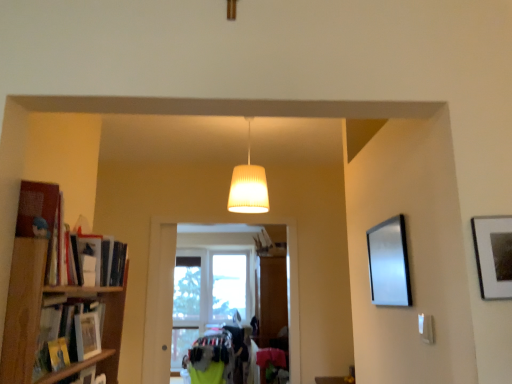
Question: From a real-world perspective, is silver metallic picture frame at right located beneath wooden bookshelf at left?

Choices:
 (A) yes
 (B) no

Answer: (B)

Question: Considering the relative positions of silver metallic picture frame at right and wooden bookshelf at left in the image provided, is silver metallic picture frame at right behind wooden bookshelf at left?

Choices:
 (A) yes
 (B) no

Answer: (A)

Question: Is silver metallic picture frame at right not close to wooden bookshelf at left?

Choices:
 (A) yes
 (B) no

Answer: (A)

Question: From the image's perspective, does silver metallic picture frame at right appear lower than wooden bookshelf at left?

Choices:
 (A) no
 (B) yes

Answer: (A)

Question: From the image's perspective, does silver metallic picture frame at right appear higher than wooden bookshelf at left?

Choices:
 (A) yes
 (B) no

Answer: (A)

Question: Are silver metallic picture frame at right and wooden bookshelf at left making contact?

Choices:
 (A) no
 (B) yes

Answer: (A)

Question: Is the depth of silver metallic picture frame at right greater than that of white ribbed lampshade at center?

Choices:
 (A) no
 (B) yes

Answer: (A)

Question: Is silver metallic picture frame at right shorter than white ribbed lampshade at center?

Choices:
 (A) yes
 (B) no

Answer: (A)

Question: Considering the relative sizes of silver metallic picture frame at right and white ribbed lampshade at center in the image provided, is silver metallic picture frame at right taller than white ribbed lampshade at center?

Choices:
 (A) no
 (B) yes

Answer: (A)

Question: From a real-world perspective, is silver metallic picture frame at right on white ribbed lampshade at center?

Choices:
 (A) no
 (B) yes

Answer: (A)

Question: Is silver metallic picture frame at right oriented away from white ribbed lampshade at center?

Choices:
 (A) no
 (B) yes

Answer: (A)

Question: Is silver metallic picture frame at right in contact with white ribbed lampshade at center?

Choices:
 (A) no
 (B) yes

Answer: (A)

Question: Is hardcover book at left, which is the 2th book in bottom-to-top order, at the right side of silver metallic picture frame at right?

Choices:
 (A) no
 (B) yes

Answer: (A)